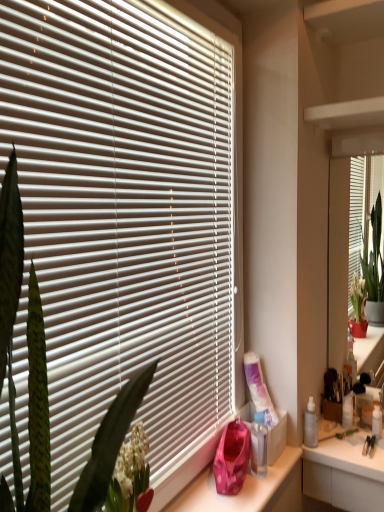
You are a GUI agent. You are given a task and a screenshot of the screen. Output one action in this format:
    pyautogui.click(x=<x>, y=<y>)
    Task: Click on the vacant area located to the right-hand side of translucent plastic spray bottle at right, which ranks as the second toiletry in back-to-front order
    The image size is (384, 512).
    Given the screenshot: What is the action you would take?
    pyautogui.click(x=349, y=445)